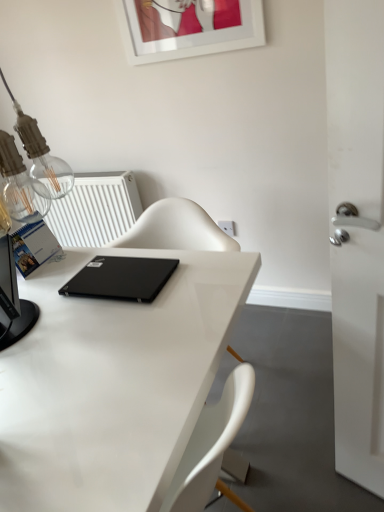
Question: From the image's perspective, is white plastic electric outlet at upper center over white plastic radiator at upper left?

Choices:
 (A) yes
 (B) no

Answer: (B)

Question: Are white plastic electric outlet at upper center and white plastic radiator at upper left making contact?

Choices:
 (A) yes
 (B) no

Answer: (B)

Question: Considering the relative sizes of white plastic electric outlet at upper center and white plastic radiator at upper left in the image provided, is white plastic electric outlet at upper center shorter than white plastic radiator at upper left?

Choices:
 (A) no
 (B) yes

Answer: (B)

Question: Is white plastic electric outlet at upper center facing away from white plastic radiator at upper left?

Choices:
 (A) yes
 (B) no

Answer: (B)

Question: Is white plastic electric outlet at upper center not inside white plastic radiator at upper left?

Choices:
 (A) yes
 (B) no

Answer: (A)

Question: Considering the positions of white plastic radiator at upper left and white plastic electric outlet at upper center in the image, is white plastic radiator at upper left wider or thinner than white plastic electric outlet at upper center?

Choices:
 (A) wide
 (B) thin

Answer: (A)

Question: From the image's perspective, relative to white plastic electric outlet at upper center, is white plastic radiator at upper left above or below?

Choices:
 (A) below
 (B) above

Answer: (B)

Question: From their relative heights in the image, would you say white plastic radiator at upper left is taller or shorter than white plastic electric outlet at upper center?

Choices:
 (A) short
 (B) tall

Answer: (B)

Question: From a real-world perspective, is white plastic radiator at upper left physically located above or below white plastic electric outlet at upper center?

Choices:
 (A) above
 (B) below

Answer: (A)

Question: From the image's perspective, is black matte laptop at center above or below white plastic electric outlet at upper center?

Choices:
 (A) below
 (B) above

Answer: (A)

Question: In terms of height, does black matte laptop at center look taller or shorter compared to white plastic electric outlet at upper center?

Choices:
 (A) tall
 (B) short

Answer: (B)

Question: Would you say black matte laptop at center is to the left or to the right of white plastic electric outlet at upper center in the picture?

Choices:
 (A) left
 (B) right

Answer: (A)

Question: Relative to white plastic electric outlet at upper center, is black matte laptop at center in front or behind?

Choices:
 (A) behind
 (B) front

Answer: (B)

Question: Considering the positions of black matte laptop at center and white glossy desk at center in the image, is black matte laptop at center wider or thinner than white glossy desk at center?

Choices:
 (A) wide
 (B) thin

Answer: (B)

Question: Is black matte laptop at center spatially inside white glossy desk at center, or outside of it?

Choices:
 (A) outside
 (B) inside

Answer: (A)